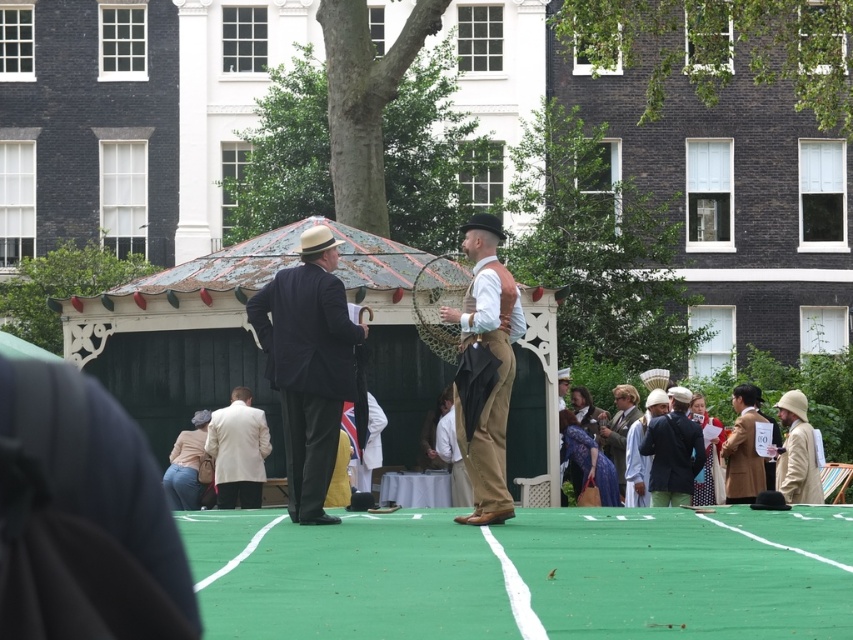
You are a photographer positioned at the edge of the tennis court. You want to capture a photo that includes both the dark blue suit at center and the light beige fabric coat at center. Given that your camera has a maximum focus range of 10 meters, will you be able to take a clear photo of both subjects simultaneously?

The distance between the dark blue suit at center and the light beige fabric coat at center is 9.32 meters, which is within the camera maximum focus range of 10 meters. Therefore, you can take a clear photo of both subjects simultaneously.

You are a photographer trying to capture both the dark blue suit at center and the light beige fabric coat at center in a single frame. Based on their positions, which one do you think will require you to adjust your camera angle more to include fully in the photo?

The dark blue suit at center might require adjusting the camera angle more because it is wider than the light beige fabric coat at center.